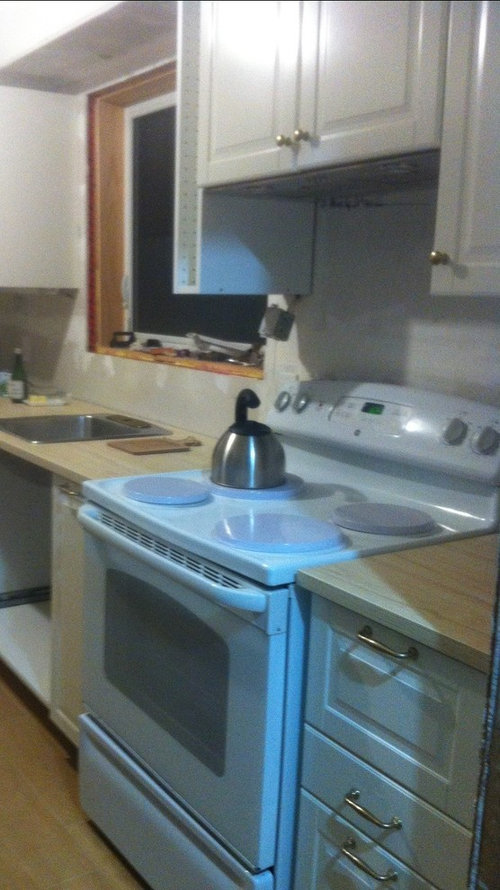
Identify the location of kitchen benches. Image resolution: width=500 pixels, height=890 pixels. (380, 578), (94, 465).